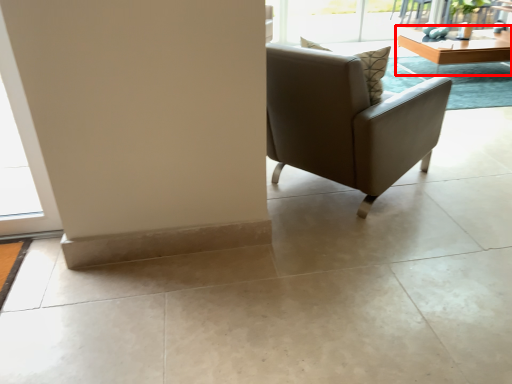
Question: From the image's perspective, considering the relative positions of table (annotated by the red box) and chair in the image provided, where is table (annotated by the red box) located with respect to the staircase?

Choices:
 (A) below
 (B) above

Answer: (B)